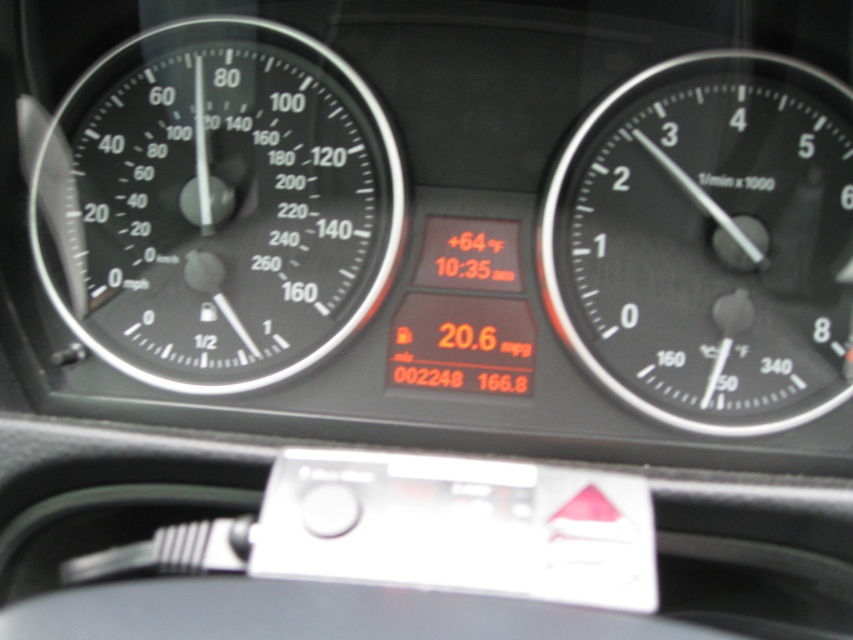
You are a mechanic working on a car and need to access both the black glass speedometer at left and the camera. The tools you have are placed on a shelf 1.5 meters away from the speedometer. Can you reach both items without moving the tools?

The distance between the black glass speedometer at left and the camera is 1.71 meters. Since the tools are 1.5 meters away from the speedometer, you cannot reach the camera as it is farther than the tool reach.

You are a driver looking at the car dashboard. You see the black glass speedometer at left and the black matte tachometer at right. Which instrument is positioned to the left side of the dashboard?

The black glass speedometer at left is positioned to the left side of the dashboard, as it is located to the left of the black matte tachometer at right.

You are a driver checking your dashboard. You notice the black glass speedometer at left and the black matte tachometer at right. Which instrument is closer to you?

The black glass speedometer at left is closer to you because the black matte tachometer at right is behind it.